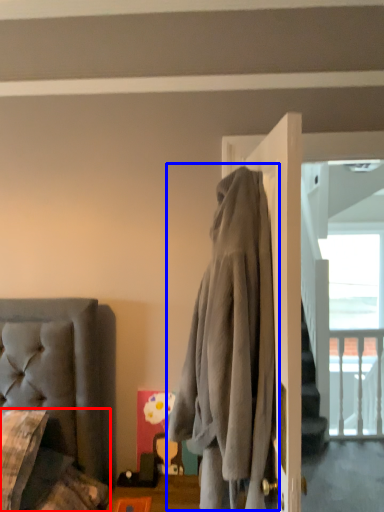
Question: Which object appears farthest to the camera in this image, couch (highlighted by a red box) or clothing (highlighted by a blue box)?

Choices:
 (A) couch
 (B) clothing

Answer: (A)